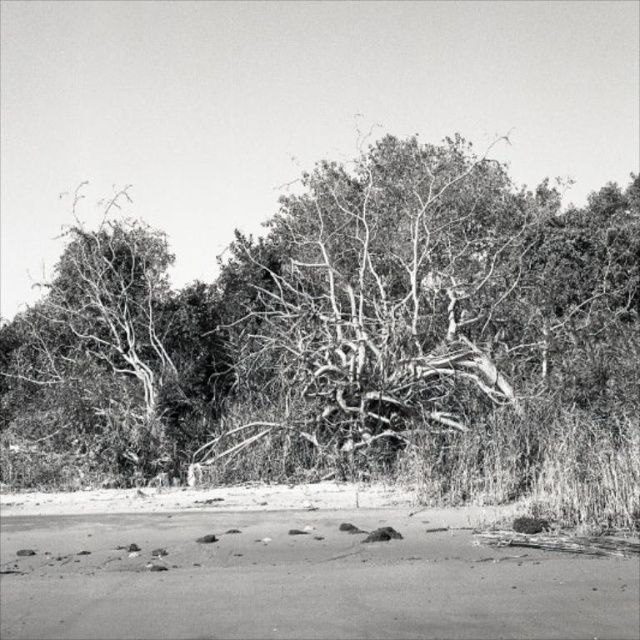
Looking at this image, you are standing on the smooth sand at lower center and want to reach the grainy bark tree at center. Which direction should you move to get closer to the tree?

You should move forward because the grainy bark tree at center is taller than smooth sand at lower center, meaning it is further away from you.

You are a photographer trying to capture the contrast between the grainy bark tree at center and the smooth sand at lower center. Which object would appear larger in your photo?

The grainy bark tree at center would appear larger in the photo since it is bigger than the smooth sand at lower center according to the description.

You are standing at the origin point in the image and want to walk towards the point labeled point (170, 557). Will you pass by point (554, 252) along the way?

No, because point (554, 252) is behind point (170, 557), so you would reach point (170, 557) first without passing by point (554, 252).